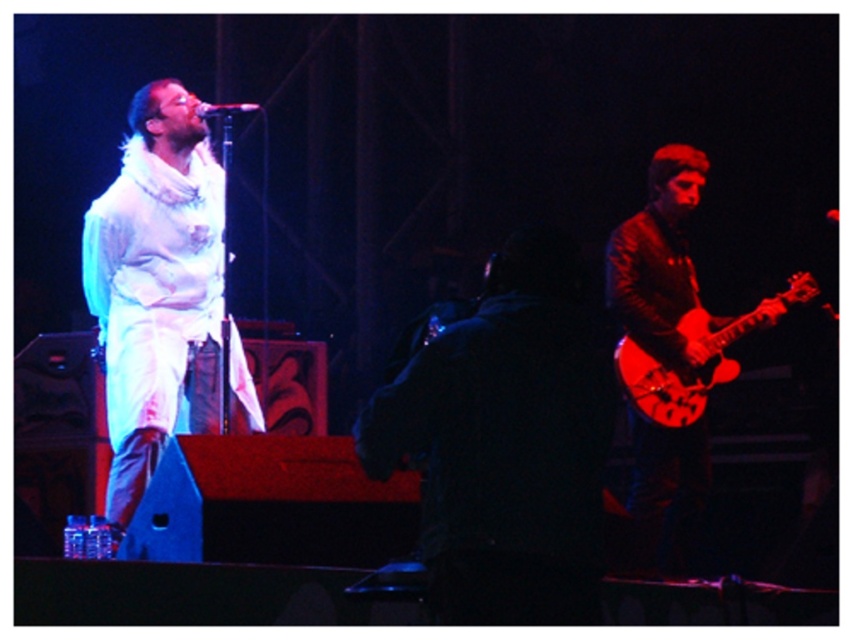
You are a photographer at the concert venue. You need to capture a photo that includes both the white cotton shirt at left and the glossy wood guitar at right. Based on their positions, which object should you place on the left side of your camera frame?

The white cotton shirt at left should be placed on the left side of your camera frame since it is already positioned to the left of the glossy wood guitar at right in the scene.